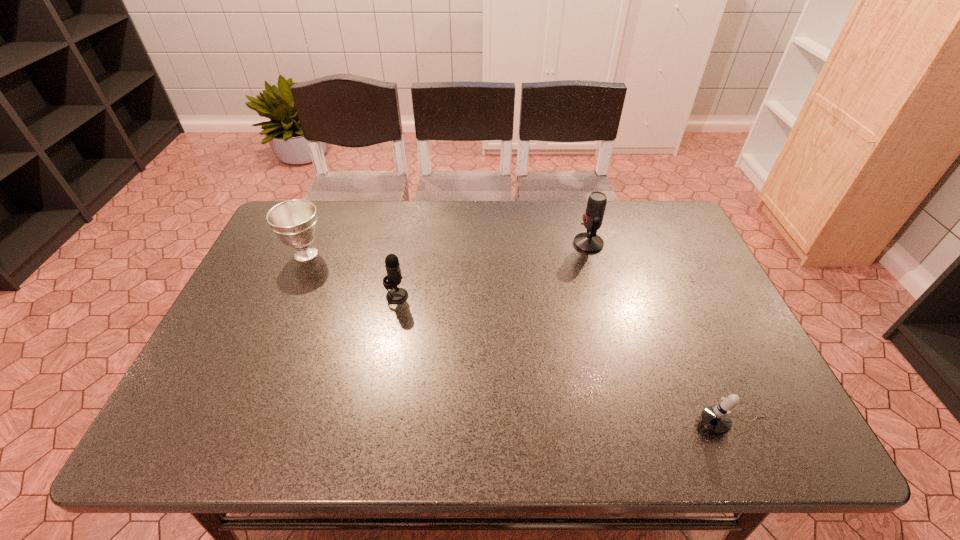
Find the location of `free spot that satisfies the following two spatial constraints: 1. on the front side of the rightmost microphone; 2. on the right side of the second farthest microphone`. free spot that satisfies the following two spatial constraints: 1. on the front side of the rightmost microphone; 2. on the right side of the second farthest microphone is located at coordinates (372, 425).

Locate an element on the screen. The image size is (960, 540). vacant region that satisfies the following two spatial constraints: 1. on the front side of the chalice; 2. on the left side of the second object from left to right is located at coordinates (288, 296).

At what (x,y) coordinates should I click in order to perform the action: click on vacant region that satisfies the following two spatial constraints: 1. on the side of the rightmost microphone with the red ring; 2. on the right side of the third object from left to right. Please return your answer as a coordinate pair (x, y). This screenshot has width=960, height=540. Looking at the image, I should click on [638, 425].